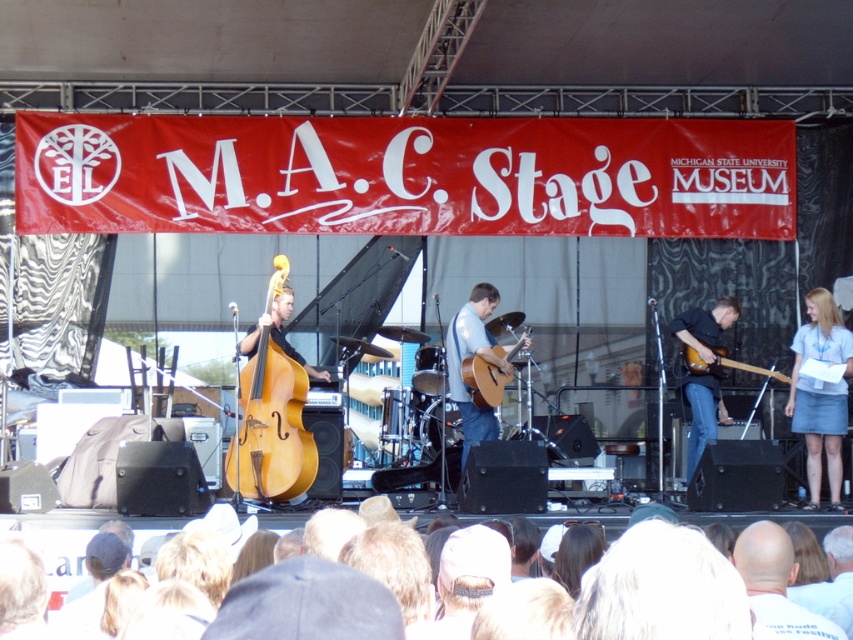
You are a photographer at the M.A.C. Stage event. You need to capture a closeup shot of the light brown wood upright bass at center and the wooden acoustic guitar at center. Since the two instruments are next to each other, will you need to adjust your camera focus to accommodate their size difference?

The light brown wood upright bass at center is larger than the wooden acoustic guitar at center, so you will need to adjust your camera focus to ensure both instruments are in clear view given their size difference.

You are a stagehand setting up a microphone stand. The stand requires 2 feet of space to the left and right of the object it faces. You need to place it either in front of the light brown wood upright bass at center or the denim skirt at right. Which object can accommodate the microphone stand without blocking the performer?

The light brown wood upright bass at center can accommodate the microphone stand because it is wider than the denim skirt at right, providing enough space for the required 2 feet on both sides.

Consider the image. You are a photographer at the M.A.C. Stage event. You want to capture a photo of the bald head at center and the light brown wood upright bass at center. Which object is wider in the image?

The light brown wood upright bass at center is wider than the bald head at center.